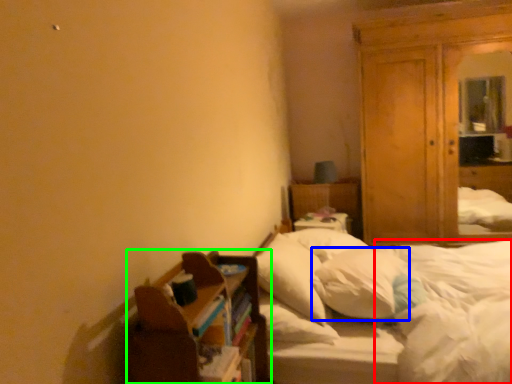
Question: Estimate the real-world distances between objects in this image. Which object is closer to mattress (highlighted by a red box), pillow (highlighted by a blue box) or shelf (highlighted by a green box)?

Choices:
 (A) pillow
 (B) shelf

Answer: (A)